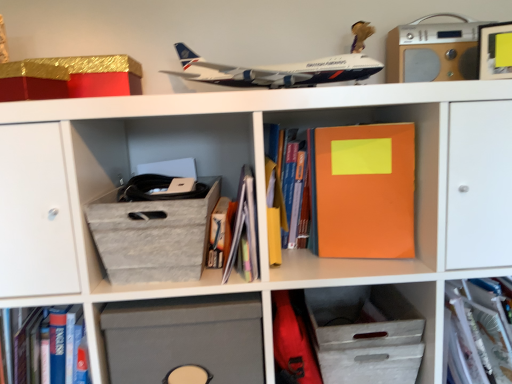
Describe the element at coordinates (365, 190) in the screenshot. The height and width of the screenshot is (384, 512). I see `orange matte notebook at center` at that location.

Describe the element at coordinates (300, 195) in the screenshot. I see `hardcover book at center, positioned as the 2th book in right-to-left order` at that location.

The width and height of the screenshot is (512, 384). What do you see at coordinates (185, 337) in the screenshot?
I see `matte gray storage box at lower center, which is counted as the first cabinet, starting from the left` at bounding box center [185, 337].

This screenshot has height=384, width=512. What are the coordinates of `gold glittery cardboard box at upper left` in the screenshot? It's located at (71, 77).

At what (x,y) coordinates should I click in order to perform the action: click on translucent plastic folder at center, which ranks as the 4th book in left-to-right order. Please return your answer as a coordinate pair (x, y). This screenshot has height=384, width=512. Looking at the image, I should click on (476, 340).

Find the location of `white textured drawer at lower center, arranged as the second cabinet when viewed from the left`. white textured drawer at lower center, arranged as the second cabinet when viewed from the left is located at coordinates (352, 335).

From the image's perspective, who appears lower, orange matte notebook at center or matte gray storage box at lower center, which is counted as the first cabinet, starting from the left?

matte gray storage box at lower center, which is counted as the first cabinet, starting from the left, appears lower in the image.

From a real-world perspective, is orange matte notebook at center physically below matte gray storage box at lower center, which is counted as the first cabinet, starting from the left?

No.

Measure the distance between orange matte notebook at center and matte gray storage box at lower center, which is counted as the 2th cabinet, starting from the right.

orange matte notebook at center and matte gray storage box at lower center, which is counted as the 2th cabinet, starting from the right, are 13.63 inches apart.

Considering the relative sizes of orange matte notebook at center and matte gray storage box at lower center, which is counted as the 2th cabinet, starting from the right, in the image provided, is orange matte notebook at center bigger than matte gray storage box at lower center, which is counted as the 2th cabinet, starting from the right,?

No.

Is hardcover book at center, which appears as the fourth book when viewed from the right, behind matte gray storage box at lower center, which is counted as the first cabinet, starting from the left?

That is True.

Can you tell me how much hardcover book at center, which appears as the fourth book when viewed from the right, and matte gray storage box at lower center, which is counted as the first cabinet, starting from the left, differ in facing direction?

The facing directions of hardcover book at center, which appears as the fourth book when viewed from the right, and matte gray storage box at lower center, which is counted as the first cabinet, starting from the left, are 1.39 degrees apart.

Is matte gray storage box at lower center, which is counted as the 2th cabinet, starting from the right, a part of hardcover book at center, which is the 1th book from left to right?

No, hardcover book at center, which is the 1th book from left to right, does not contain matte gray storage box at lower center, which is counted as the 2th cabinet, starting from the right.

In terms of height, does hardcover book at center, which appears as the fourth book when viewed from the right, look taller or shorter compared to matte gray storage box at lower center, which is counted as the first cabinet, starting from the left?

In the image, hardcover book at center, which appears as the fourth book when viewed from the right, appears to be shorter than matte gray storage box at lower center, which is counted as the first cabinet, starting from the left.

Does matte gray storage box at lower center, which is counted as the 2th cabinet, starting from the right, turn towards matte paper book at center, arranged as the third book when viewed from the right?

No, matte gray storage box at lower center, which is counted as the 2th cabinet, starting from the right, is not aimed at matte paper book at center, arranged as the third book when viewed from the right.

Considering the relative positions of matte gray storage box at lower center, which is counted as the 2th cabinet, starting from the right, and matte paper book at center, placed as the 2th book when sorted from left to right, in the image provided, is matte gray storage box at lower center, which is counted as the 2th cabinet, starting from the right, to the left of matte paper book at center, placed as the 2th book when sorted from left to right, from the viewer's perspective?

Yes, matte gray storage box at lower center, which is counted as the 2th cabinet, starting from the right, is to the left of matte paper book at center, placed as the 2th book when sorted from left to right.

From a real-world perspective, is matte gray storage box at lower center, which is counted as the first cabinet, starting from the left, above or below matte paper book at center, arranged as the third book when viewed from the right?

matte gray storage box at lower center, which is counted as the first cabinet, starting from the left, is below matte paper book at center, arranged as the third book when viewed from the right.

Can we say matte gray storage box at lower center, which is counted as the 2th cabinet, starting from the right, lies outside matte paper book at center, placed as the 2th book when sorted from left to right?

That's correct, matte gray storage box at lower center, which is counted as the 2th cabinet, starting from the right, is outside of matte paper book at center, placed as the 2th book when sorted from left to right.

From a real-world perspective, is orange matte notebook at center above or below white textured drawer at lower center, marked as the first cabinet in a right-to-left arrangement?

In terms of real-world spatial position, orange matte notebook at center is above white textured drawer at lower center, marked as the first cabinet in a right-to-left arrangement.

From the image's perspective, which is above, orange matte notebook at center or white textured drawer at lower center, arranged as the second cabinet when viewed from the left?

orange matte notebook at center.

Considering the sizes of objects orange matte notebook at center and white textured drawer at lower center, arranged as the second cabinet when viewed from the left, in the image provided, who is taller, orange matte notebook at center or white textured drawer at lower center, arranged as the second cabinet when viewed from the left,?

orange matte notebook at center.

Can you confirm if orange matte notebook at center is positioned to the right of white textured drawer at lower center, marked as the first cabinet in a right-to-left arrangement?

No, orange matte notebook at center is not to the right of white textured drawer at lower center, marked as the first cabinet in a right-to-left arrangement.

Between wooden stereo at upper right and matte gray storage box at lower center, which is counted as the 2th cabinet, starting from the right, which one has more height?

With more height is matte gray storage box at lower center, which is counted as the 2th cabinet, starting from the right.

Is wooden stereo at upper right not inside matte gray storage box at lower center, which is counted as the first cabinet, starting from the left?

wooden stereo at upper right lies outside matte gray storage box at lower center, which is counted as the first cabinet, starting from the left,'s area.

Are wooden stereo at upper right and matte gray storage box at lower center, which is counted as the 2th cabinet, starting from the right, beside each other?

No, wooden stereo at upper right is not next to matte gray storage box at lower center, which is counted as the 2th cabinet, starting from the right.

Are hardcover book at center, positioned as the 2th book in right-to-left order, and white textured drawer at lower center, arranged as the second cabinet when viewed from the left, beside each other?

hardcover book at center, positioned as the 2th book in right-to-left order, and white textured drawer at lower center, arranged as the second cabinet when viewed from the left, are not in contact.

From the image's perspective, is hardcover book at center, positioned as the 2th book in right-to-left order, beneath white textured drawer at lower center, arranged as the second cabinet when viewed from the left?

Actually, hardcover book at center, positioned as the 2th book in right-to-left order, appears above white textured drawer at lower center, arranged as the second cabinet when viewed from the left, in the image.

Is hardcover book at center, positioned as the 2th book in right-to-left order, inside or outside of white textured drawer at lower center, arranged as the second cabinet when viewed from the left?

hardcover book at center, positioned as the 2th book in right-to-left order, is not enclosed by white textured drawer at lower center, arranged as the second cabinet when viewed from the left.

Which is behind, white textured drawer at lower center, marked as the first cabinet in a right-to-left arrangement, or orange matte notebook at center?

Positioned behind is white textured drawer at lower center, marked as the first cabinet in a right-to-left arrangement.

Is white textured drawer at lower center, arranged as the second cabinet when viewed from the left, far away from orange matte notebook at center?

No.

Can you confirm if white textured drawer at lower center, marked as the first cabinet in a right-to-left arrangement, is positioned to the right of orange matte notebook at center?

Indeed, white textured drawer at lower center, marked as the first cabinet in a right-to-left arrangement, is positioned on the right side of orange matte notebook at center.

Who is smaller, white textured drawer at lower center, arranged as the second cabinet when viewed from the left, or orange matte notebook at center?

orange matte notebook at center is smaller.

This screenshot has width=512, height=384. In order to click on the 1st cabinet below the orange matte notebook at center (from the image's perspective) in this screenshot , I will do `click(185, 337)`.

Find the location of a particular element. The width and height of the screenshot is (512, 384). the 1st book behind the matte gray storage box at lower center, which is counted as the first cabinet, starting from the left is located at coordinates (218, 233).

From the image, which object appears to be farther from translucent plastic folder at center, which ranks as the 4th book in left-to-right order, orange matte notebook at center or matte paper book at center, arranged as the third book when viewed from the right?

matte paper book at center, arranged as the third book when viewed from the right, is positioned further to the anchor translucent plastic folder at center, which ranks as the 4th book in left-to-right order.

Which object lies further to the anchor point hardcover book at center, the third book viewed from the left, gray fabric shoe box at center-left or matte gray storage box at lower center, which is counted as the 2th cabinet, starting from the right?

Based on the image, matte gray storage box at lower center, which is counted as the 2th cabinet, starting from the right, appears to be further to hardcover book at center, the third book viewed from the left.

Which object lies further to the anchor point matte paper book at center, placed as the 2th book when sorted from left to right, hardcover book at center, which appears as the fourth book when viewed from the right, or white textured drawer at lower center, marked as the first cabinet in a right-to-left arrangement?

The object further to matte paper book at center, placed as the 2th book when sorted from left to right, is white textured drawer at lower center, marked as the first cabinet in a right-to-left arrangement.

When comparing their distances from white textured drawer at lower center, arranged as the second cabinet when viewed from the left, does wooden stereo at upper right or gold glittery cardboard box at upper left seem further?

gold glittery cardboard box at upper left lies further to white textured drawer at lower center, arranged as the second cabinet when viewed from the left, than the other object.

When comparing their distances from white textured drawer at lower center, marked as the first cabinet in a right-to-left arrangement, does translucent plastic folder at center, the first book in the right-to-left sequence, or hardcover book at center, the third book viewed from the left, seem further?

hardcover book at center, the third book viewed from the left.

Considering their positions, is gold glittery cardboard box at upper left positioned further to wooden stereo at upper right than hardcover book at center, the third book viewed from the left?

gold glittery cardboard box at upper left is further to wooden stereo at upper right.

Considering their positions, is matte gray storage box at lower center, which is counted as the first cabinet, starting from the left, positioned closer to wooden stereo at upper right than hardcover book at center, positioned as the 2th book in right-to-left order?

Among the two, hardcover book at center, positioned as the 2th book in right-to-left order, is located nearer to wooden stereo at upper right.

Which object lies nearer to the anchor point translucent plastic folder at center, the first book in the right-to-left sequence, orange matte notebook at center or hardcover book at center, the third book viewed from the left?

orange matte notebook at center.

Where is `paperback book situated between matte paper book at center, placed as the 2th book when sorted from left to right, and translucent plastic folder at center, the first book in the right-to-left sequence, from left to right`? This screenshot has width=512, height=384. paperback book situated between matte paper book at center, placed as the 2th book when sorted from left to right, and translucent plastic folder at center, the first book in the right-to-left sequence, from left to right is located at coordinates (365, 190).

Locate an element on the screen. The image size is (512, 384). book between wooden stereo at upper right and orange matte notebook at center vertically is located at coordinates tap(300, 195).

Identify the location of shoe box located between gold glittery cardboard box at upper left and hardcover book at center, the third book viewed from the left, in the left-right direction. This screenshot has height=384, width=512. (153, 236).

You are a GUI agent. You are given a task and a screenshot of the screen. Output one action in this format:
    pyautogui.click(x=<x>, y=<y>)
    Task: Click on the cabinet between wooden stereo at upper right and white textured drawer at lower center, marked as the first cabinet in a right-to-left arrangement, in the vertical direction
    The image size is (512, 384).
    Given the screenshot: What is the action you would take?
    pyautogui.click(x=185, y=337)